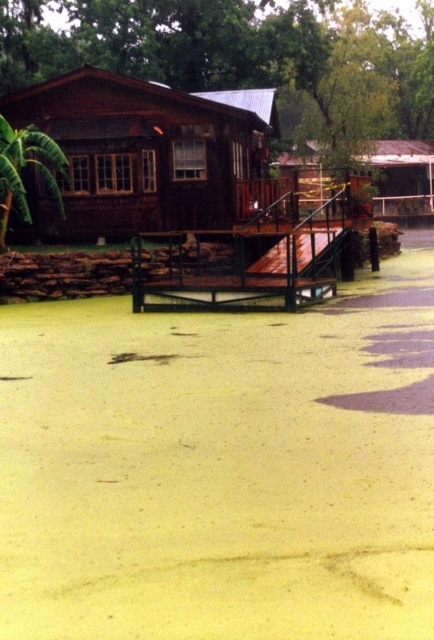
From the picture: You are planning to install a solar panel on the tallest structure between the green leafy tree at upper center and the wooden cabin at center. Which structure should you choose?

The green leafy tree at upper center is taller than the wooden cabin at center, so you should install the solar panel on the green leafy tree at upper center.

You are standing on the wooden deck in front of the wooden hut at center and want to see the green leafy tree at left. Can you see the tree clearly without moving your position?

The green leafy tree at left is behind the wooden hut at center, so you cannot see it clearly from your current position on the wooden deck in front of the wooden hut at center.

You are standing at the point closer to the camera between the two points, point (404,205) and point (25,202). Which point are you standing at?

You are standing at point (25,202) because it is closer to the camera than point (404,205).